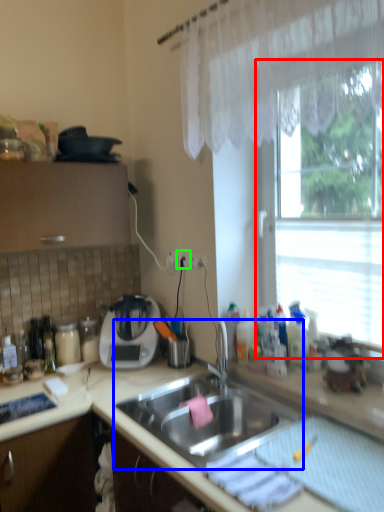
Question: Considering the real-world distances, which object is closest to window (highlighted by a red box)? sink (highlighted by a blue box) or electric outlet (highlighted by a green box).

Choices:
 (A) sink
 (B) electric outlet

Answer: (B)